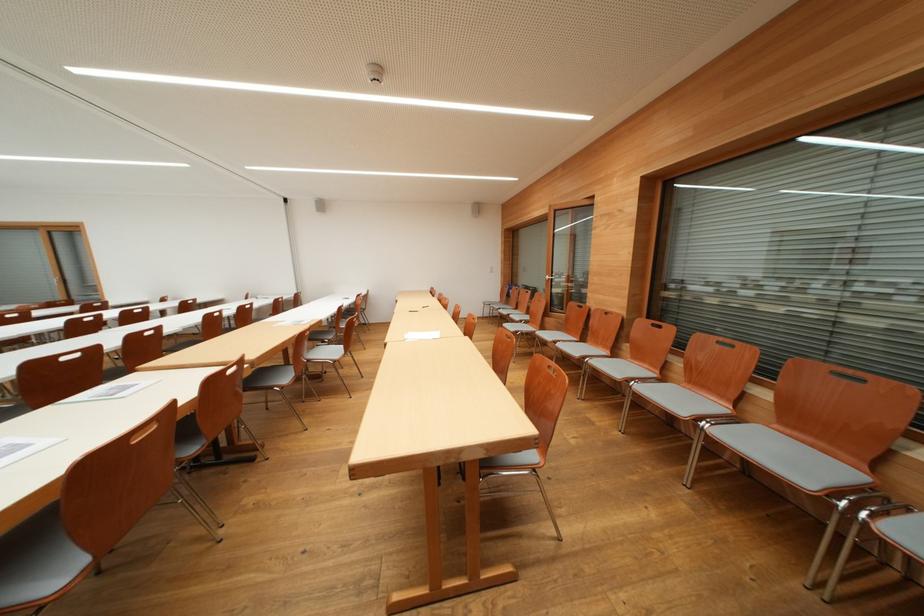
In order to click on white paper in this screenshot , I will do `click(420, 334)`.